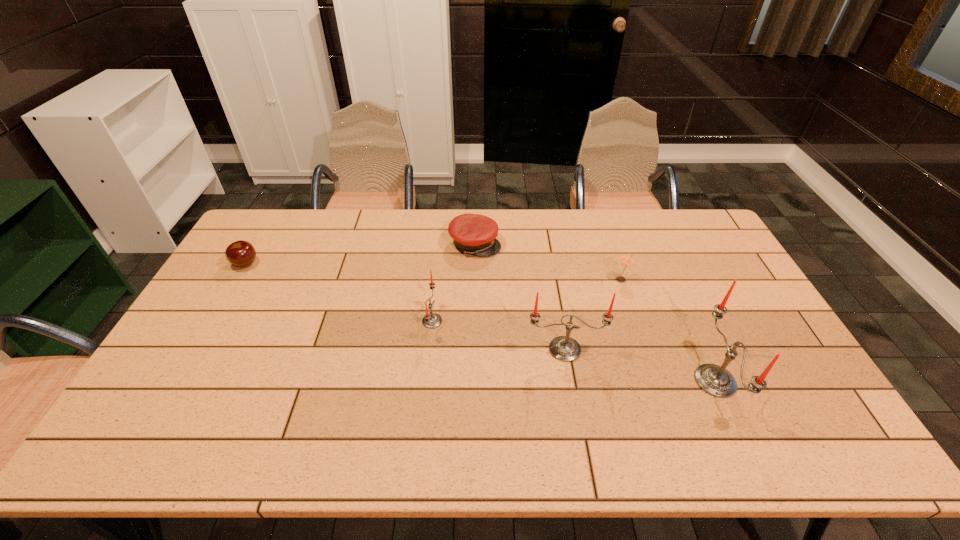
Where is `vacant spot to place a candle on the left`? The width and height of the screenshot is (960, 540). vacant spot to place a candle on the left is located at coordinates (314, 296).